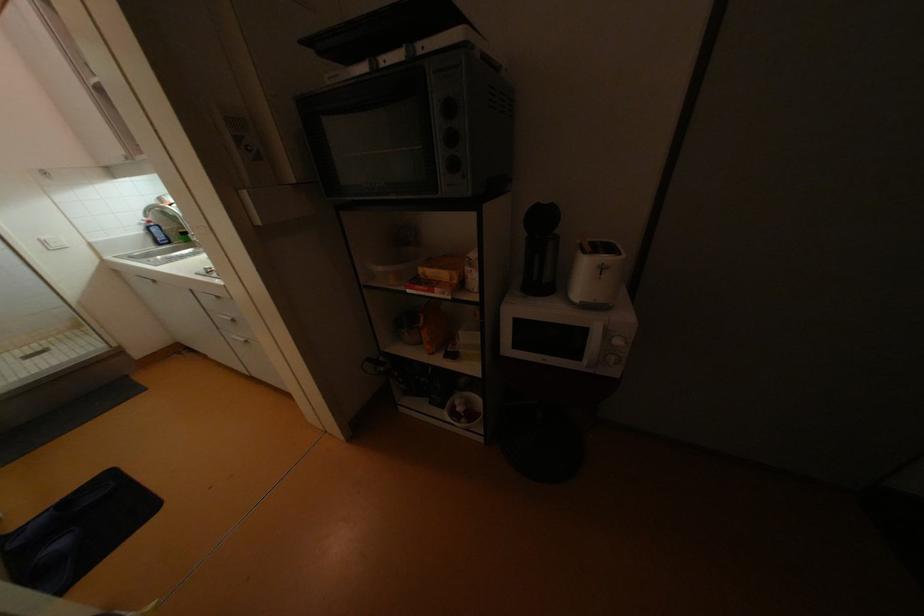
Describe the element at coordinates (226, 318) in the screenshot. The height and width of the screenshot is (616, 924). I see `the white cabinet handle` at that location.